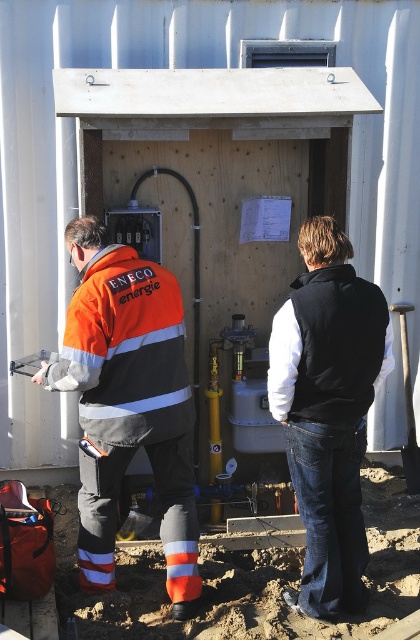
Does orange reflective jacket at center have a larger size compared to black fleece vest at center?

Indeed, orange reflective jacket at center has a larger size compared to black fleece vest at center.

Is orange reflective jacket at center shorter than black fleece vest at center?

Incorrect, orange reflective jacket at center's height does not fall short of black fleece vest at center's.

Is point (102, 404) behind point (309, 342)?

Yes, point (102, 404) is farther from viewer.

I want to click on orange reflective jacket at center, so click(130, 401).